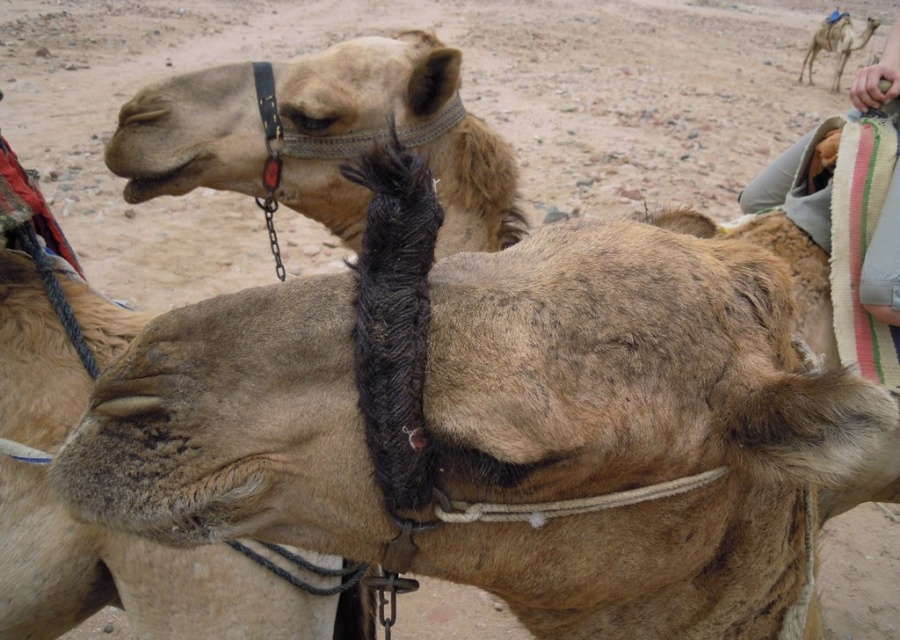
Question: Is striped fabric cushion at upper right below light brown fur at upper right?

Choices:
 (A) no
 (B) yes

Answer: (B)

Question: Which point is closer to the camera?

Choices:
 (A) (811, 60)
 (B) (749, 196)

Answer: (B)

Question: Can you confirm if fuzzy beige camel at center is bigger than striped fabric cushion at upper right?

Choices:
 (A) yes
 (B) no

Answer: (B)

Question: Can you confirm if striped fabric cushion at upper right is smaller than light brown fur at upper right?

Choices:
 (A) yes
 (B) no

Answer: (B)

Question: Estimate the real-world distances between objects in this image. Which object is closer to the striped fabric cushion at upper right?

Choices:
 (A) light brown fur at upper right
 (B) fuzzy beige camel at center

Answer: (B)

Question: Which of the following is the farthest from the observer?

Choices:
 (A) (288, 620)
 (B) (824, 42)

Answer: (B)